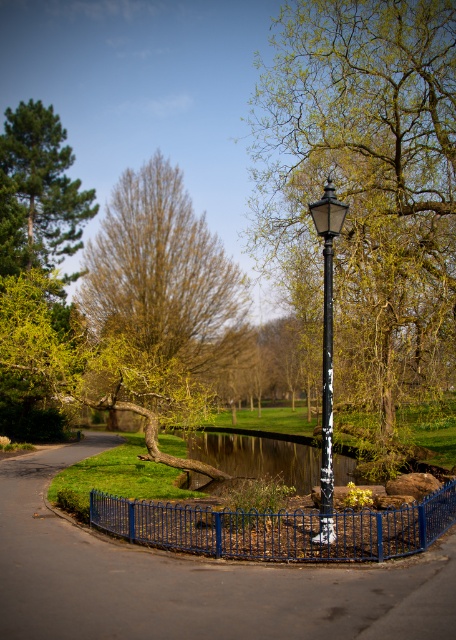
Question: Which of the following is the farthest from the observer?

Choices:
 (A) black metal street light at center
 (B) metallic pole at center
 (C) green leafy tree at center
 (D) black metal fence at center

Answer: (C)

Question: Is black metal fence at center above blue metal fence at center?

Choices:
 (A) no
 (B) yes

Answer: (A)

Question: Can you confirm if green leafy tree at center is positioned to the right of metallic pole at center?

Choices:
 (A) no
 (B) yes

Answer: (B)

Question: Which of the following is the farthest from the observer?

Choices:
 (A) (322, 404)
 (B) (19, 557)
 (C) (96, 490)
 (D) (419, 205)

Answer: (D)

Question: Which of the following is the farthest from the observer?

Choices:
 (A) black metal fence at center
 (B) green leafy tree at center

Answer: (B)

Question: Can you confirm if green leafy tree at center is bigger than black metal fence at center?

Choices:
 (A) no
 (B) yes

Answer: (B)